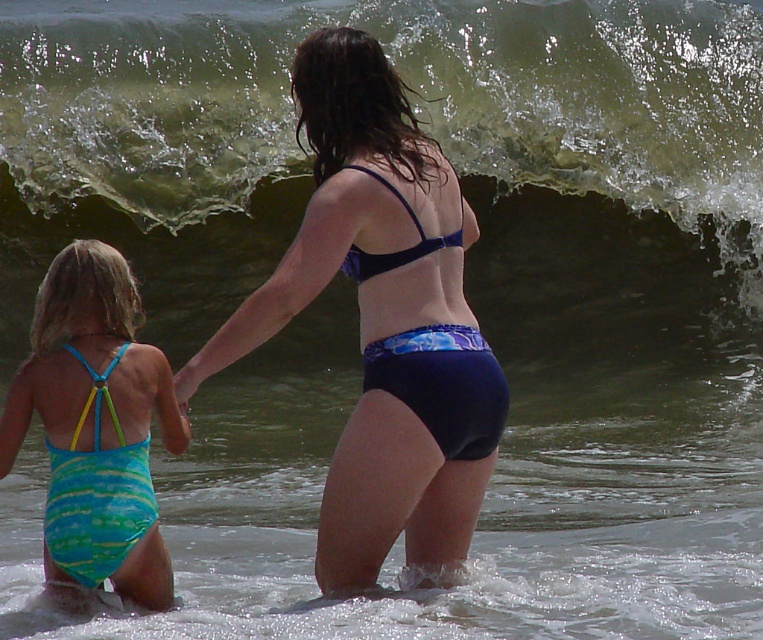
Question: Can you confirm if blue striped swimsuit at lower left is positioned below teal striped swimsuit at lower left?

Choices:
 (A) yes
 (B) no

Answer: (B)

Question: Is blue fabric bikini at center positioned before blue striped swimsuit at lower left?

Choices:
 (A) no
 (B) yes

Answer: (B)

Question: Which of the following is the closest to the observer?

Choices:
 (A) (92, 310)
 (B) (388, 180)

Answer: (B)

Question: Considering the relative positions of blue matte bikini bottom at center and teal striped swimsuit at lower left in the image provided, where is blue matte bikini bottom at center located with respect to teal striped swimsuit at lower left?

Choices:
 (A) below
 (B) above

Answer: (B)

Question: Considering the real-world distances, which object is closest to the blue matte bikini bottom at center?

Choices:
 (A) blue fabric bikini at center
 (B) blue striped swimsuit at lower left
 (C) teal striped swimsuit at lower left

Answer: (A)

Question: Estimate the real-world distances between objects in this image. Which object is farther from the blue striped swimsuit at lower left?

Choices:
 (A) blue fabric bikini at center
 (B) blue matte bikini bottom at center
 (C) teal striped swimsuit at lower left

Answer: (B)